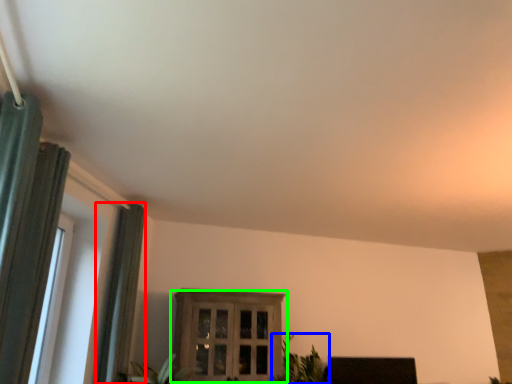
Question: Estimate the real-world distances between objects in this image. Which object is farther from curtain (highlighted by a red box), houseplant (highlighted by a blue box) or window (highlighted by a green box)?

Choices:
 (A) houseplant
 (B) window

Answer: (A)